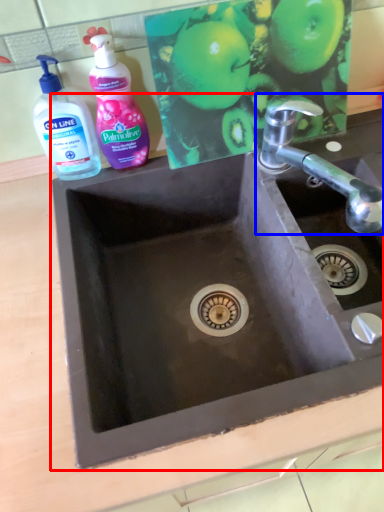
Question: Which of the following is the farthest to the observer, sink (highlighted by a red box) or tap (highlighted by a blue box)?

Choices:
 (A) sink
 (B) tap

Answer: (B)